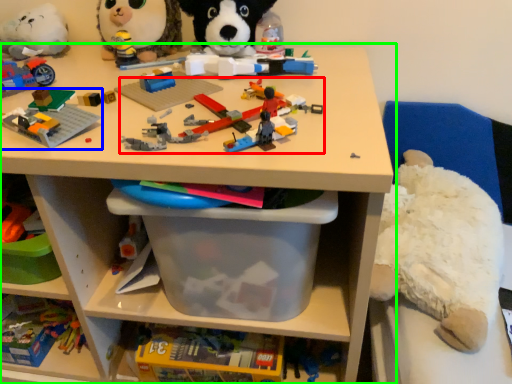
Question: Estimate the real-world distances between objects in this image. Which object is closer to toy (highlighted by a red box), toy (highlighted by a blue box) or shelf (highlighted by a green box)?

Choices:
 (A) toy
 (B) shelf

Answer: (A)